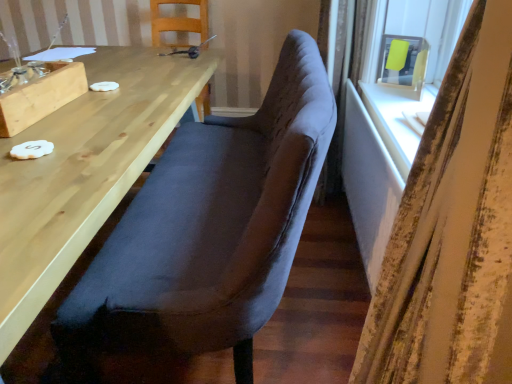
Question: Can matte yellow paper at upper right be found inside white painted wood table at right, the 2th table from the left?

Choices:
 (A) no
 (B) yes

Answer: (A)

Question: Is white painted wood table at right, the 2th table from the left, outside matte yellow paper at upper right?

Choices:
 (A) no
 (B) yes

Answer: (B)

Question: From a real-world perspective, is white painted wood table at right, the 2th table from the left, beneath matte yellow paper at upper right?

Choices:
 (A) no
 (B) yes

Answer: (B)

Question: Considering the relative sizes of white painted wood table at right, the 2th table from the left, and matte yellow paper at upper right in the image provided, is white painted wood table at right, the 2th table from the left, wider than matte yellow paper at upper right?

Choices:
 (A) no
 (B) yes

Answer: (A)

Question: From a real-world perspective, is white painted wood table at right, the 2th table from the left, on matte yellow paper at upper right?

Choices:
 (A) yes
 (B) no

Answer: (B)

Question: From the image's perspective, is white painted wood table at right, the 2th table from the left, on matte yellow paper at upper right?

Choices:
 (A) yes
 (B) no

Answer: (B)

Question: Is wooden table at left, placed as the 2th table when sorted from right to left, outside matte yellow paper at upper right?

Choices:
 (A) no
 (B) yes

Answer: (B)

Question: Considering the relative sizes of wooden table at left, placed as the 2th table when sorted from right to left, and matte yellow paper at upper right in the image provided, is wooden table at left, placed as the 2th table when sorted from right to left, bigger than matte yellow paper at upper right?

Choices:
 (A) yes
 (B) no

Answer: (A)

Question: Is wooden table at left, which is the 1th table from left to right, placed right next to matte yellow paper at upper right?

Choices:
 (A) no
 (B) yes

Answer: (A)

Question: Is wooden table at left, which is the 1th table from left to right, smaller than matte yellow paper at upper right?

Choices:
 (A) no
 (B) yes

Answer: (A)

Question: Is matte yellow paper at upper right surrounded by wooden table at left, which is the 1th table from left to right?

Choices:
 (A) yes
 (B) no

Answer: (B)

Question: Does wooden table at left, which is the 1th table from left to right, have a lesser width compared to matte yellow paper at upper right?

Choices:
 (A) no
 (B) yes

Answer: (A)

Question: Is velvet-like dark brown bench at center, acting as the first chair starting from the front, looking in the opposite direction of wooden table at left, which is the 1th table from left to right?

Choices:
 (A) yes
 (B) no

Answer: (A)